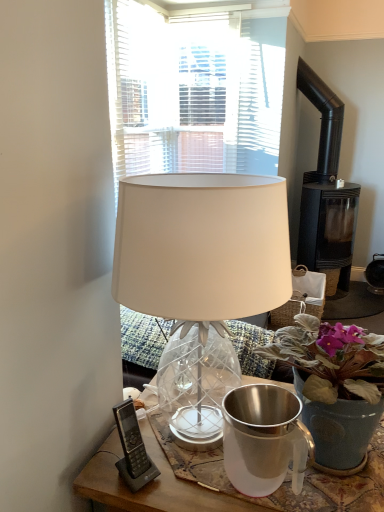
Question: Is black matte fireplace at right not close to matte blue pot at center?

Choices:
 (A) yes
 (B) no

Answer: (A)

Question: From a real-world perspective, is black matte fireplace at right over matte blue pot at center?

Choices:
 (A) yes
 (B) no

Answer: (A)

Question: Is black matte fireplace at right looking in the opposite direction of matte blue pot at center?

Choices:
 (A) no
 (B) yes

Answer: (A)

Question: Is black matte fireplace at right to the left of matte blue pot at center from the viewer's perspective?

Choices:
 (A) no
 (B) yes

Answer: (A)

Question: Is the position of black matte fireplace at right less distant than that of matte blue pot at center?

Choices:
 (A) yes
 (B) no

Answer: (B)

Question: Considering the positions of point (352, 254) and point (144, 471), is point (352, 254) closer or farther from the camera than point (144, 471)?

Choices:
 (A) farther
 (B) closer

Answer: (A)

Question: Looking at their shapes, would you say black matte fireplace at right is wider or thinner than black plastic phone at lower left?

Choices:
 (A) wide
 (B) thin

Answer: (A)

Question: Do you think black matte fireplace at right is within black plastic phone at lower left, or outside of it?

Choices:
 (A) outside
 (B) inside

Answer: (A)

Question: From a real-world perspective, is black matte fireplace at right physically located above or below black plastic phone at lower left?

Choices:
 (A) above
 (B) below

Answer: (A)

Question: Based on their sizes in the image, would you say shiny metallic jug at center is bigger or smaller than black matte fireplace at right?

Choices:
 (A) small
 (B) big

Answer: (A)

Question: In terms of width, does shiny metallic jug at center look wider or thinner when compared to black matte fireplace at right?

Choices:
 (A) thin
 (B) wide

Answer: (A)

Question: Which is correct: shiny metallic jug at center is inside black matte fireplace at right, or outside of it?

Choices:
 (A) outside
 (B) inside

Answer: (A)

Question: Considering the positions of shiny metallic jug at center and black matte fireplace at right in the image, is shiny metallic jug at center taller or shorter than black matte fireplace at right?

Choices:
 (A) tall
 (B) short

Answer: (B)

Question: From the image's perspective, is white glass lamp at center positioned above or below black plastic phone at lower left?

Choices:
 (A) above
 (B) below

Answer: (A)

Question: In the image, is white glass lamp at center positioned in front of or behind black plastic phone at lower left?

Choices:
 (A) front
 (B) behind

Answer: (A)